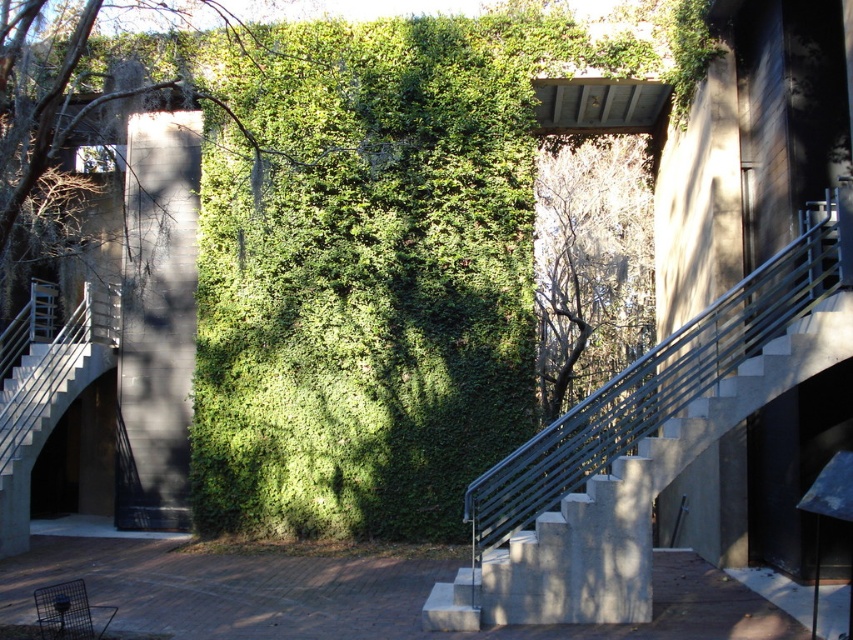
Question: Can you confirm if concrete stairs at center is positioned above green leafy tree at center?

Choices:
 (A) no
 (B) yes

Answer: (A)

Question: From the image, what is the correct spatial relationship of concrete stairs at center in relation to green leafy tree at center?

Choices:
 (A) right
 (B) left

Answer: (B)

Question: Among these points, which one is farthest from the camera?

Choices:
 (A) (578, 596)
 (B) (631, 147)

Answer: (B)

Question: Does concrete stairs at center have a smaller size compared to green leafy wall at upper center?

Choices:
 (A) yes
 (B) no

Answer: (A)

Question: Which point appears closest to the camera in this image?

Choices:
 (A) click(x=637, y=196)
 (B) click(x=32, y=168)

Answer: (B)

Question: Considering the real-world distances, which object is farthest from the concrete stairs at center?

Choices:
 (A) green leafy wall at upper center
 (B) green leafy tree at center

Answer: (B)